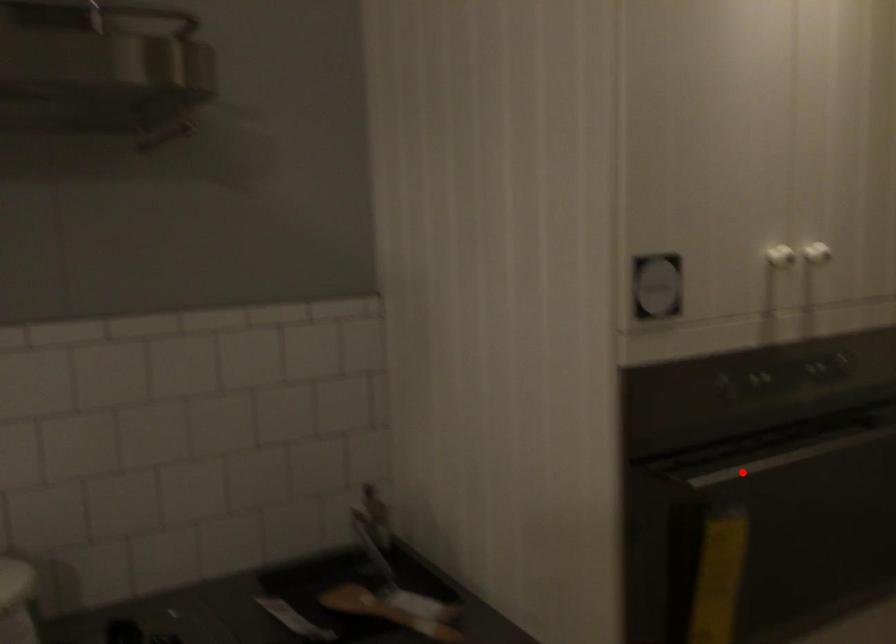
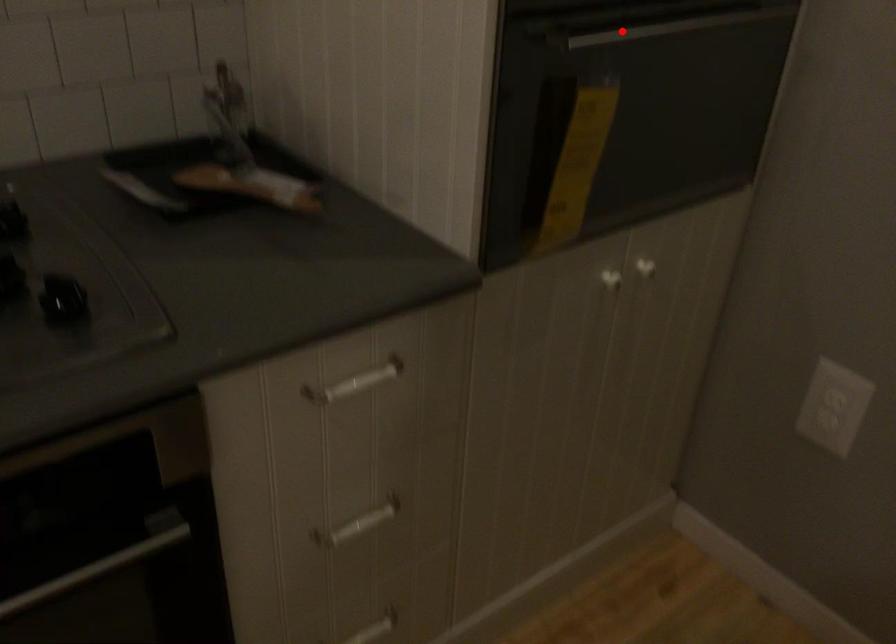
I am providing you with two images of the same scene from different viewpoints. A red point is marked on the first image and another point is marked on the second image. Do the highlighted points in image1 and image2 indicate the same real-world spot?

Yes